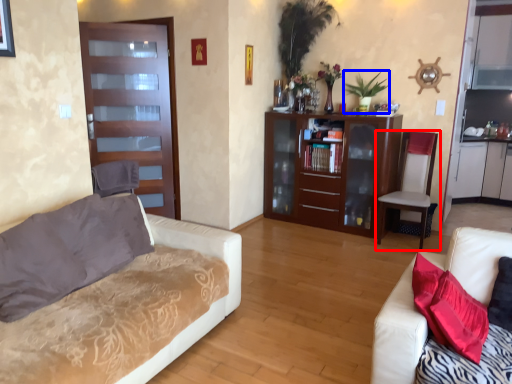
Question: Among these objects, which one is farthest to the camera, chair (highlighted by a red box) or plant (highlighted by a blue box)?

Choices:
 (A) chair
 (B) plant

Answer: (B)